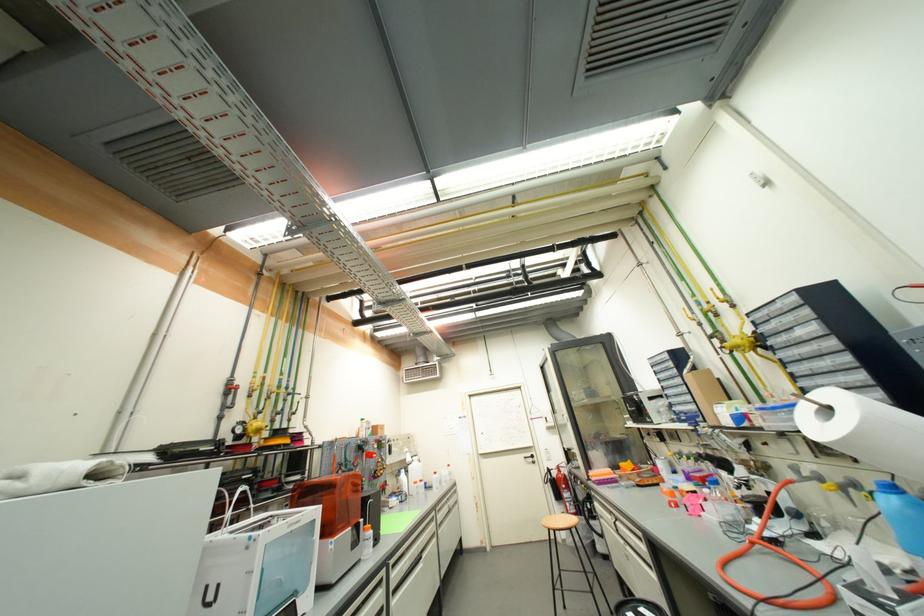
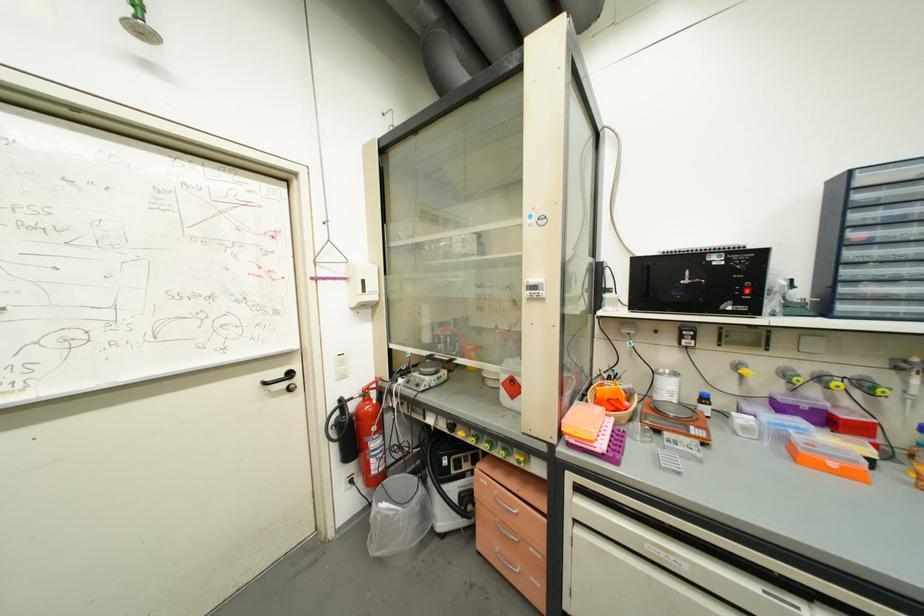
The point at (536, 461) is marked in the first image. Where is the corresponding point in the second image?

(289, 387)